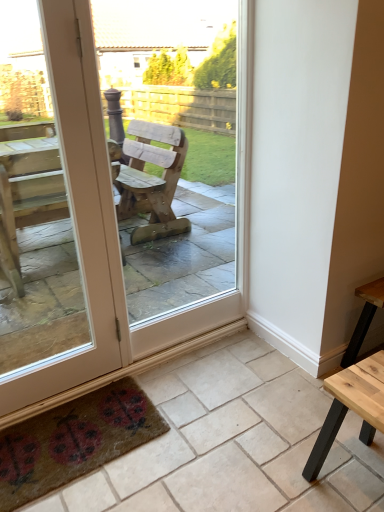
The height and width of the screenshot is (512, 384). I want to click on unoccupied space behind light brown wooden table at lower right, so click(x=312, y=420).